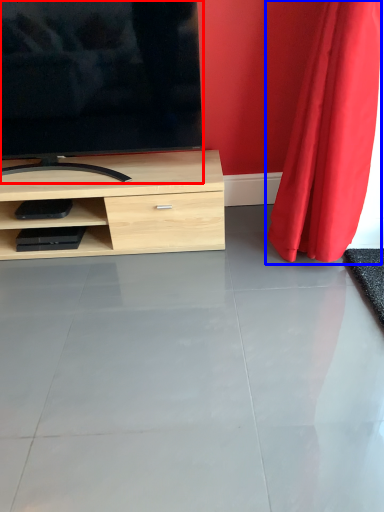
Question: Which point is closer to the camera, television (highlighted by a red box) or curtain (highlighted by a blue box)?

Choices:
 (A) television
 (B) curtain

Answer: (B)